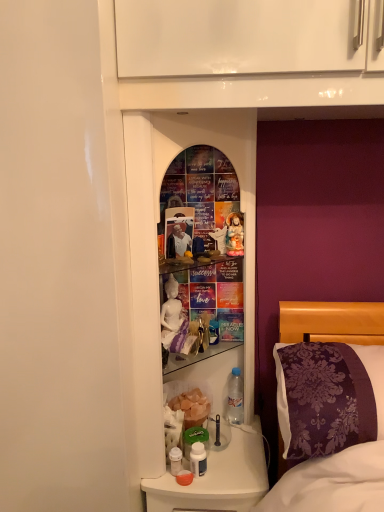
Where is `free point above translucent plastic bottles at lower center (from a real-world perspective)`? free point above translucent plastic bottles at lower center (from a real-world perspective) is located at coordinates (220, 454).